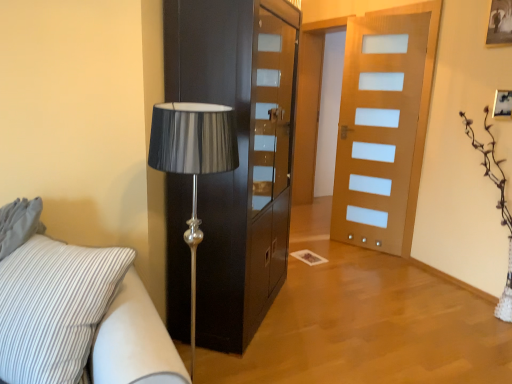
Question: From the image's perspective, is black glossy cabinet at center on top of wooden door at center?

Choices:
 (A) yes
 (B) no

Answer: (B)

Question: Would you say black glossy cabinet at center is outside wooden door at center?

Choices:
 (A) no
 (B) yes

Answer: (B)

Question: Is black glossy cabinet at center beside wooden door at center?

Choices:
 (A) yes
 (B) no

Answer: (B)

Question: Can you confirm if black glossy cabinet at center is bigger than wooden door at center?

Choices:
 (A) no
 (B) yes

Answer: (B)

Question: Is black glossy cabinet at center shorter than wooden door at center?

Choices:
 (A) no
 (B) yes

Answer: (B)

Question: Could wooden door at center be considered to be inside black glossy cabinet at center?

Choices:
 (A) yes
 (B) no

Answer: (B)

Question: From a real-world perspective, does white striped fabric studio couch at lower left sit lower than black glossy cabinet at center?

Choices:
 (A) yes
 (B) no

Answer: (A)

Question: Considering the relative positions of white striped fabric studio couch at lower left and black glossy cabinet at center in the image provided, is white striped fabric studio couch at lower left behind black glossy cabinet at center?

Choices:
 (A) yes
 (B) no

Answer: (B)

Question: From the image's perspective, is white striped fabric studio couch at lower left located above black glossy cabinet at center?

Choices:
 (A) yes
 (B) no

Answer: (B)

Question: Would you say white striped fabric studio couch at lower left contains black glossy cabinet at center?

Choices:
 (A) no
 (B) yes

Answer: (A)

Question: Is the depth of white striped fabric studio couch at lower left less than that of black glossy cabinet at center?

Choices:
 (A) no
 (B) yes

Answer: (B)

Question: Could you tell me if white striped fabric studio couch at lower left is turned towards black glossy cabinet at center?

Choices:
 (A) no
 (B) yes

Answer: (A)

Question: Can you confirm if wooden door at center is bigger than white striped fabric studio couch at lower left?

Choices:
 (A) yes
 (B) no

Answer: (B)